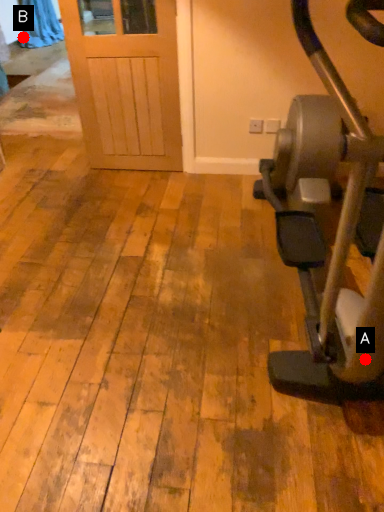
Question: Two points are circled on the image, labeled by A and B beside each circle. Which point appears farthest from the camera in this image?

Choices:
 (A) A is further
 (B) B is further

Answer: (B)